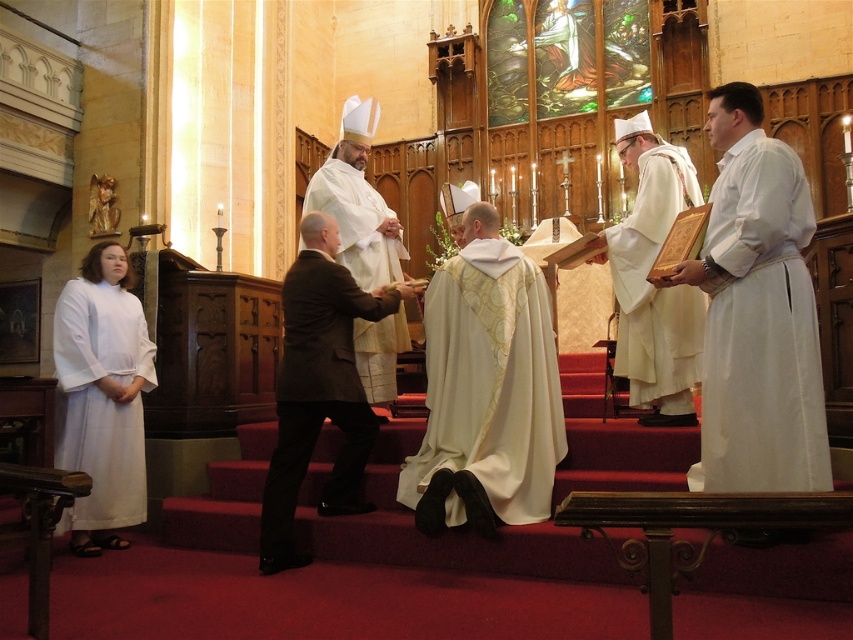
Question: Estimate the real-world distances between objects in this image. Which object is closer to the white textured fabric at center?

Choices:
 (A) white silk robe at center
 (B) dark gray wool suit at center

Answer: (B)

Question: Which object is farther from the camera taking this photo?

Choices:
 (A) dark gray wool suit at center
 (B) white cloth robe at right

Answer: (A)

Question: Is dark gray wool suit at center thinner than white textured robe at center?

Choices:
 (A) yes
 (B) no

Answer: (B)

Question: Can you confirm if dark gray wool suit at center is positioned to the right of white matte/soft robe at left?

Choices:
 (A) yes
 (B) no

Answer: (A)

Question: Can you confirm if white cloth robe at right is bigger than white matte/soft robe at left?

Choices:
 (A) no
 (B) yes

Answer: (B)

Question: Which point is closer to the camera taking this photo?

Choices:
 (A) (425, 314)
 (B) (799, 376)

Answer: (B)